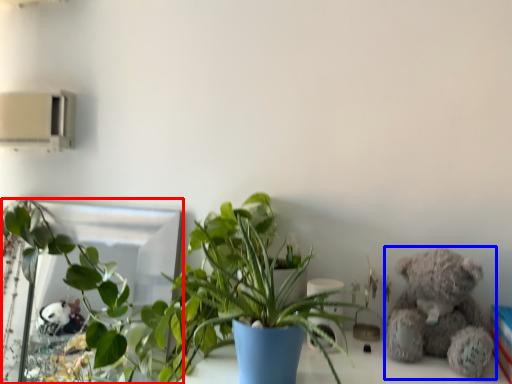
Question: Which object appears farthest to the camera in this image, mirror (highlighted by a red box) or teddy bear (highlighted by a blue box)?

Choices:
 (A) mirror
 (B) teddy bear

Answer: (A)